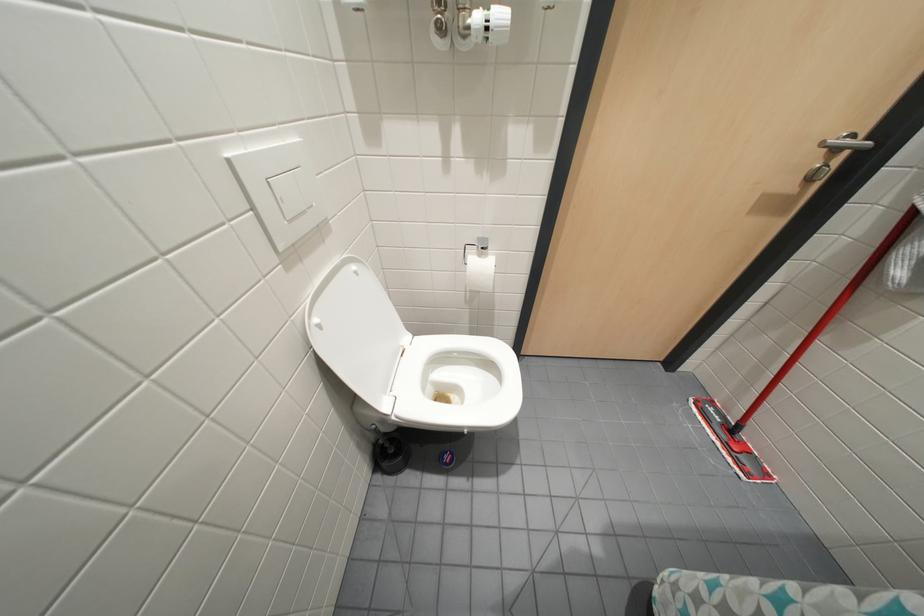
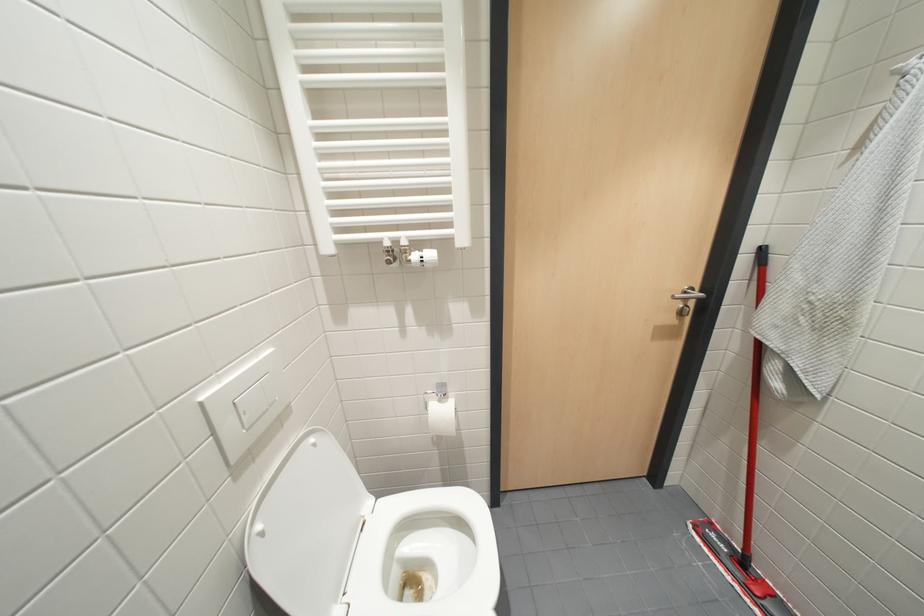
Which direction would the cameraman need to move to produce the second image?

The movement direction of the cameraman is right, backward.